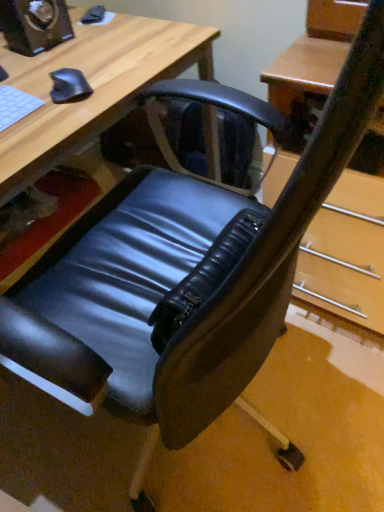
Question: Can you see matte black speaker at upper left touching black matte mouse at upper left?

Choices:
 (A) no
 (B) yes

Answer: (A)

Question: Does matte black speaker at upper left turn towards black matte mouse at upper left?

Choices:
 (A) no
 (B) yes

Answer: (B)

Question: From the image's perspective, is matte black speaker at upper left on black matte mouse at upper left?

Choices:
 (A) yes
 (B) no

Answer: (A)

Question: From the image's perspective, is matte black speaker at upper left beneath black matte mouse at upper left?

Choices:
 (A) no
 (B) yes

Answer: (A)

Question: Does matte black speaker at upper left appear on the right side of black matte mouse at upper left?

Choices:
 (A) yes
 (B) no

Answer: (B)

Question: Does matte black speaker at upper left appear on the left side of black matte mouse at upper left?

Choices:
 (A) yes
 (B) no

Answer: (A)

Question: Is black matte mouse at upper left oriented away from white matte keyboard at upper left?

Choices:
 (A) no
 (B) yes

Answer: (A)

Question: Does black matte mouse at upper left have a smaller size compared to white matte keyboard at upper left?

Choices:
 (A) no
 (B) yes

Answer: (B)

Question: Is black matte mouse at upper left at the left side of white matte keyboard at upper left?

Choices:
 (A) no
 (B) yes

Answer: (A)

Question: Is black matte mouse at upper left further to camera compared to white matte keyboard at upper left?

Choices:
 (A) yes
 (B) no

Answer: (A)

Question: Can you confirm if black matte mouse at upper left is thinner than white matte keyboard at upper left?

Choices:
 (A) yes
 (B) no

Answer: (A)

Question: Is black matte mouse at upper left far from white matte keyboard at upper left?

Choices:
 (A) yes
 (B) no

Answer: (B)

Question: Can you confirm if matte black chair at lower left is positioned to the left of white matte keyboard at upper left?

Choices:
 (A) no
 (B) yes

Answer: (B)